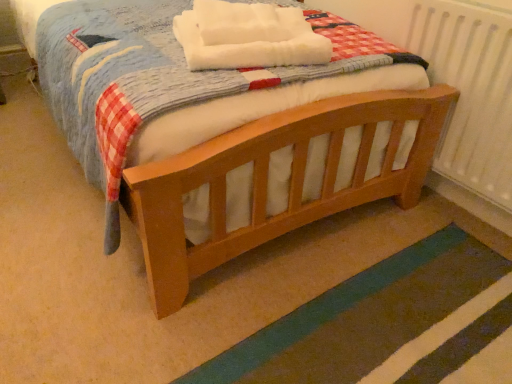
Find the location of a particular element. This screenshot has height=384, width=512. vacant space underneath teal rug at lower right (from a real-world perspective) is located at coordinates (395, 327).